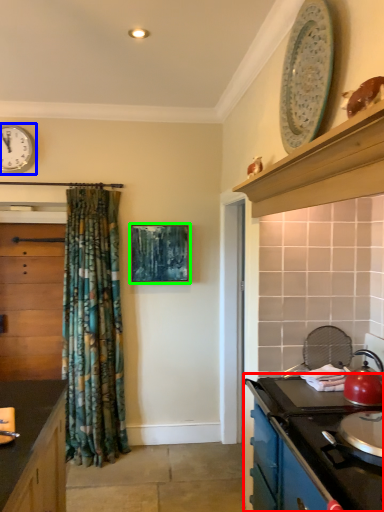
Question: Which object is the closest to the cabinetry (highlighted by a red box)? Choose among these: clock (highlighted by a blue box) or picture frame (highlighted by a green box).

Choices:
 (A) clock
 (B) picture frame

Answer: (B)